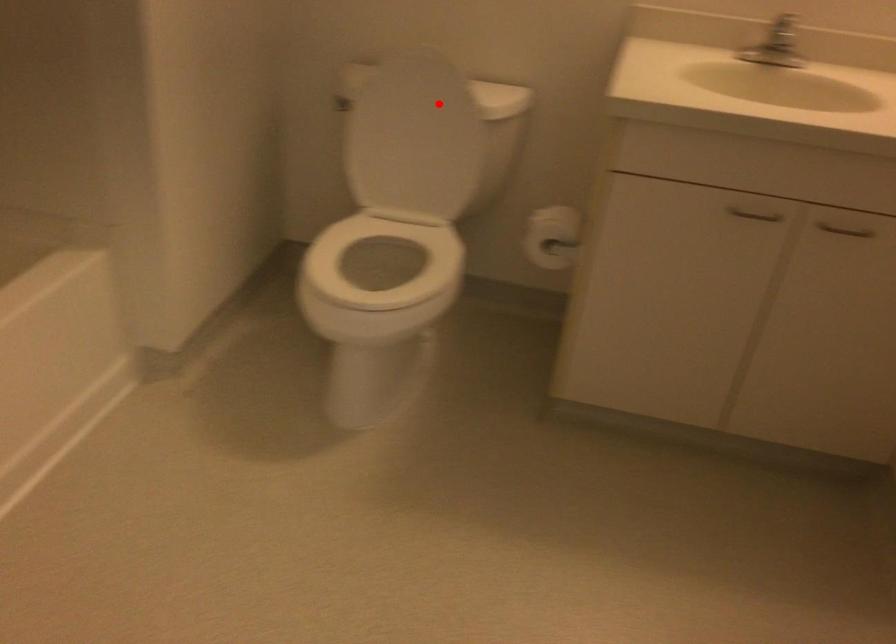
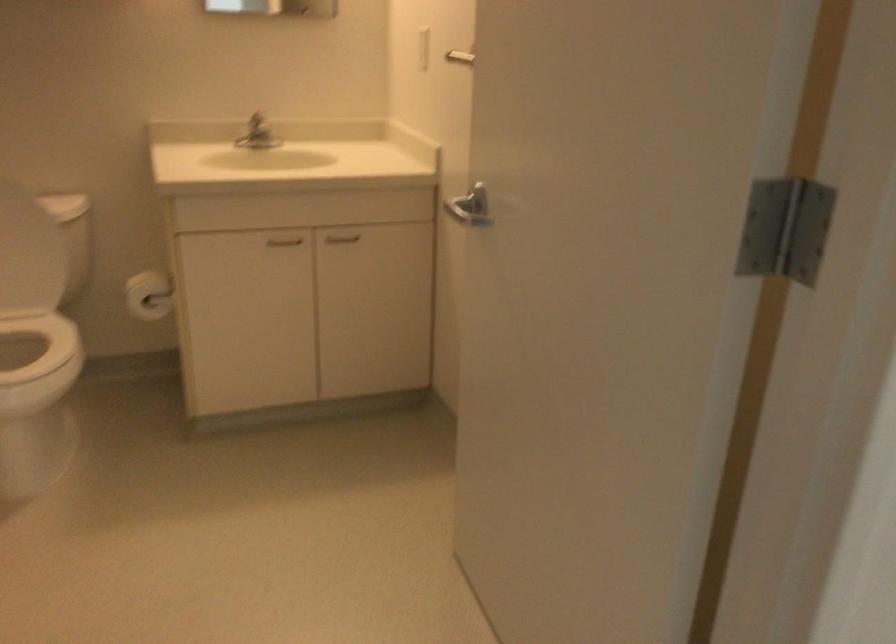
Locate, in the second image, the point that corresponds to the highlighted location in the first image.

(12, 210)